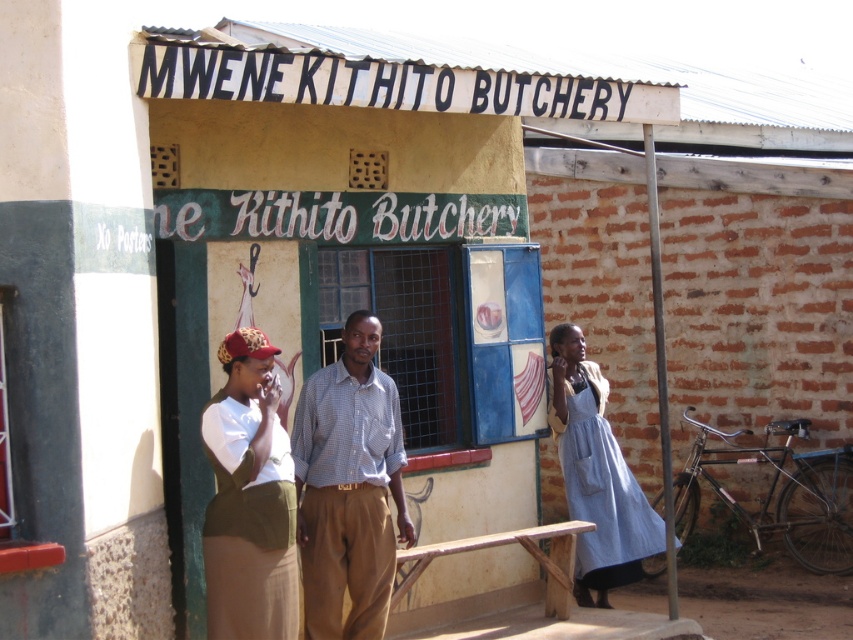
You are a customer entering MWENE KITHITO BUTCHERY and you see two people outside the shop. One is wearing a checkered fabric shirt at center and the other is wearing a denim dress at right. Which person is standing closer to the entrance of the butchery?

The checkered fabric shirt at center is above denim dress at right, which means the person wearing the checkered fabric shirt at center is standing closer to the entrance of the butchery than the person in the denim dress at right.

You are a delivery person with a box that is 1.5 meters wide. You need to pass between the checkered fabric shirt at center and the denim dress at right. Can your box fit through the space between them?

The distance between the checkered fabric shirt at center and the denim dress at right is 2.01 meters, which is wider than the box. Therefore, the box can fit through the space between them.